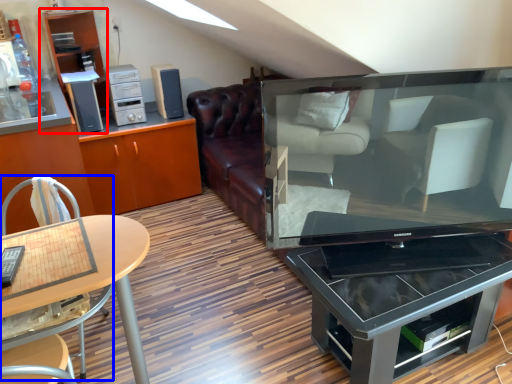
Question: Which object appears closest to the camera in this image, shelf (highlighted by a red box) or chair (highlighted by a blue box)?

Choices:
 (A) shelf
 (B) chair

Answer: (B)